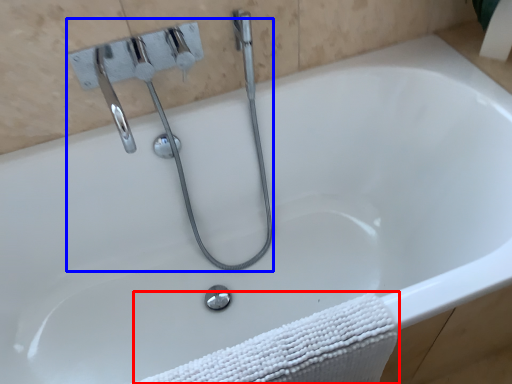
Question: Among these objects, which one is nearest to the camera, bath towel (highlighted by a red box) or plumbing fixture (highlighted by a blue box)?

Choices:
 (A) bath towel
 (B) plumbing fixture

Answer: (A)